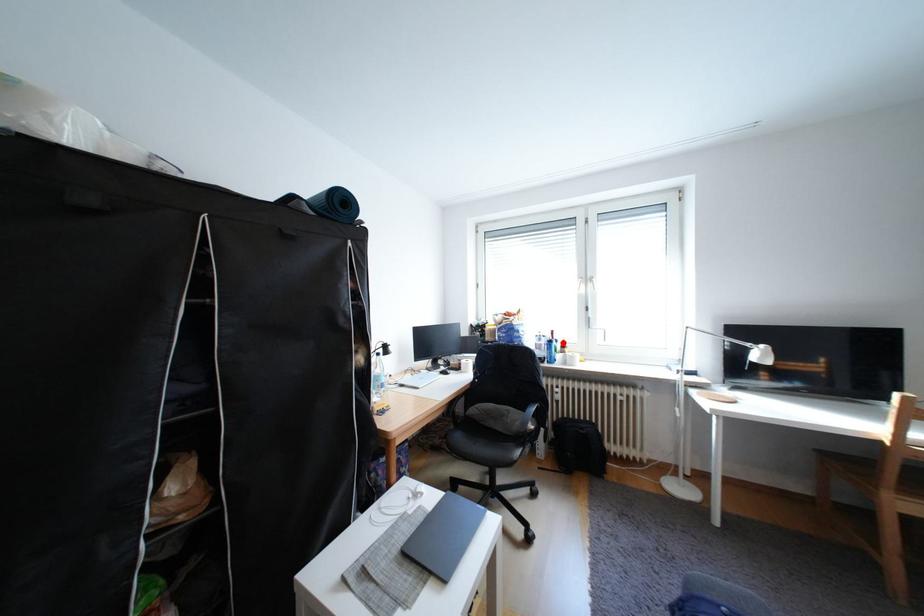
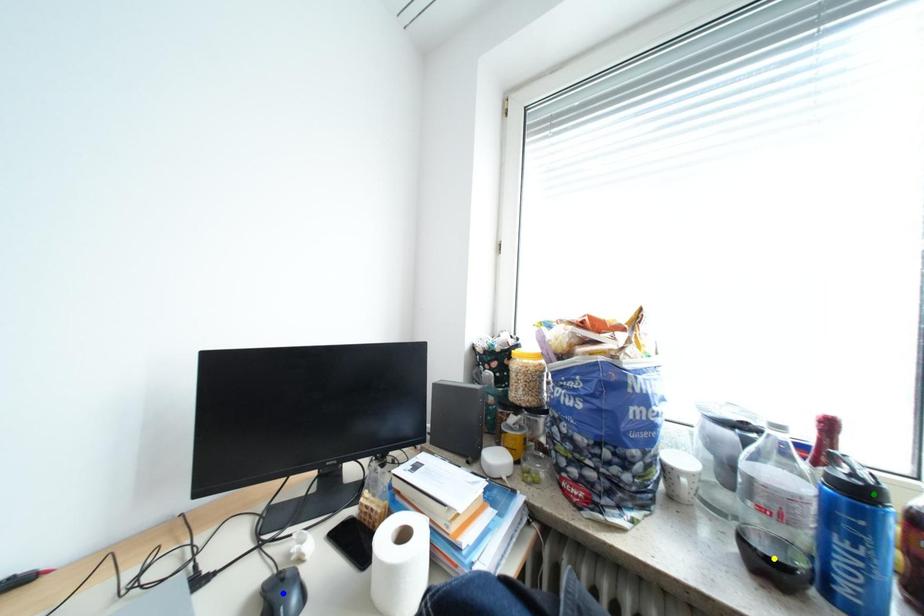
Question: I am providing you with two images of the same scene from different viewpoints. A red point is marked on the first image. You are given multiple points on the second image. Which point in image 2 represents the same 3d spot as the red point in image 1?

Choices:
 (A) yellow point
 (B) green point
 (C) blue point

Answer: (B)